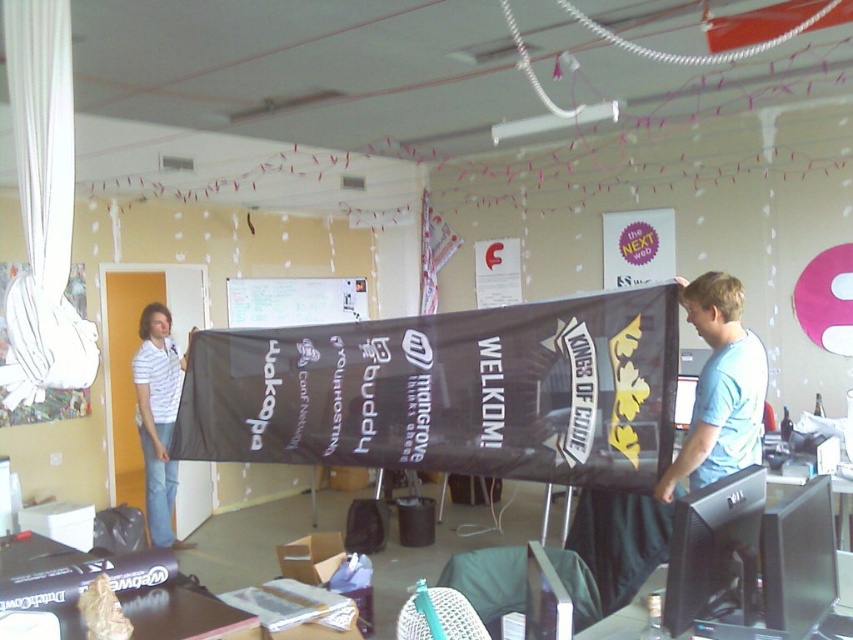
Question: Among these points, which one is farthest from the camera?

Choices:
 (A) (392, 362)
 (B) (720, 272)

Answer: (B)

Question: Is black fabric banner at center behind white striped shirt at left?

Choices:
 (A) no
 (B) yes

Answer: (A)

Question: Is light blue t-shirt at center behind white striped shirt at left?

Choices:
 (A) yes
 (B) no

Answer: (B)

Question: Does black fabric banner at center have a larger size compared to light blue t-shirt at center?

Choices:
 (A) yes
 (B) no

Answer: (A)

Question: Based on their relative distances, which object is farther from the black glossy monitor at lower right?

Choices:
 (A) white striped shirt at left
 (B) light blue t-shirt at center

Answer: (A)

Question: Which point appears farthest from the camera in this image?

Choices:
 (A) (697, 307)
 (B) (543, 317)
 (C) (177, 371)

Answer: (C)